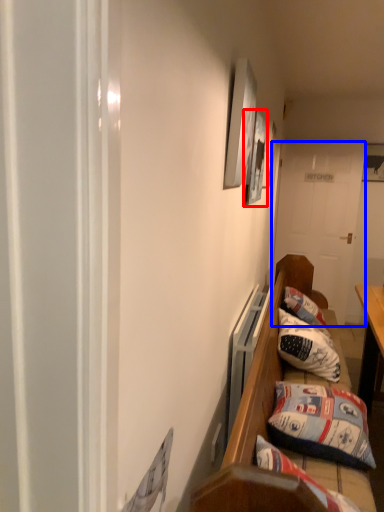
Question: Which object appears farthest to the camera in this image, picture frame (highlighted by a red box) or door (highlighted by a blue box)?

Choices:
 (A) picture frame
 (B) door

Answer: (B)